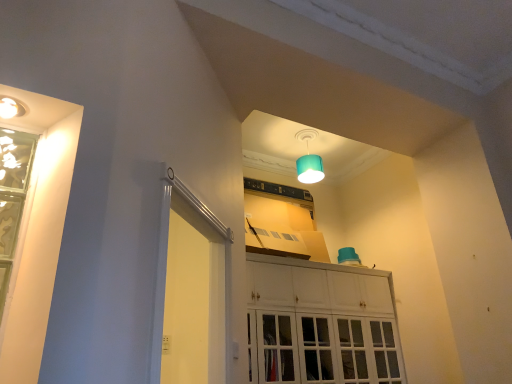
Locate an element on the screen. The image size is (512, 384). white glossy cabinet at center is located at coordinates (320, 323).

What is the approximate height of white glossy cabinet at center?

white glossy cabinet at center is 1.06 meters tall.

Image resolution: width=512 pixels, height=384 pixels. Find the location of `white glossy screen door at left`. white glossy screen door at left is located at coordinates (189, 290).

Is white glossy screen door at left not within green glass window at left?

Yes, white glossy screen door at left is outside of green glass window at left.

In the image, there is a green glass window at left. What are the coordinates of `screen door below it (from the image's perspective)` in the screenshot? It's located at (189, 290).

From the image's perspective, is white glossy screen door at left under green glass window at left?

Yes, from the image's perspective, white glossy screen door at left is beneath green glass window at left.

Is the position of white glossy screen door at left more distant than that of green glass window at left?

Yes, white glossy screen door at left is behind green glass window at left.

Which of these two, white glossy cabinet at center or white glossy screen door at left, is bigger?

Bigger between the two is white glossy cabinet at center.

In the scene shown: From a real-world perspective, which is physically above, white glossy cabinet at center or white glossy screen door at left?

white glossy cabinet at center.

What's the angular difference between white glossy cabinet at center and white glossy screen door at left's facing directions?

The angular difference between white glossy cabinet at center and white glossy screen door at left is 44.8 degrees.

From the picture: Would you say white glossy cabinet at center is inside or outside white glossy screen door at left?

white glossy cabinet at center is located beyond the bounds of white glossy screen door at left.

Is the surface of white glossy screen door at left in direct contact with teal fabric lampshade at upper center?

white glossy screen door at left and teal fabric lampshade at upper center are clearly separated.

Which point is more forward, (221,324) or (304,166)?

The point (221,324) is closer.

Considering the sizes of objects teal fabric lampshade at upper center and green glass window at left in the image provided, who is thinner, teal fabric lampshade at upper center or green glass window at left?

green glass window at left is thinner.

In the image, is teal fabric lampshade at upper center positioned in front of or behind green glass window at left?

teal fabric lampshade at upper center is positioned farther from the viewer than green glass window at left.

Could you tell me if teal fabric lampshade at upper center is turned towards green glass window at left?

No, teal fabric lampshade at upper center is not facing towards green glass window at left.

From a real-world perspective, is teal fabric lampshade at upper center located higher than green glass window at left?

Indeed, from a real-world perspective, teal fabric lampshade at upper center stands above green glass window at left.

Could you tell me if teal fabric lampshade at upper center is turned towards white glossy screen door at left?

No, teal fabric lampshade at upper center is not oriented towards white glossy screen door at left.

Considering the sizes of teal fabric lampshade at upper center and white glossy screen door at left in the image, is teal fabric lampshade at upper center bigger or smaller than white glossy screen door at left?

In the image, teal fabric lampshade at upper center appears to be smaller than white glossy screen door at left.

Is teal fabric lampshade at upper center far away from white glossy screen door at left?

teal fabric lampshade at upper center is far away from white glossy screen door at left.

In order to click on screen door below the teal fabric lampshade at upper center (from a real-world perspective) in this screenshot , I will do `click(189, 290)`.

Is white glossy screen door at left thinner than white glossy cabinet at center?

Yes.

The image size is (512, 384). I want to click on cabinetry that appears above the white glossy screen door at left (from a real-world perspective), so 320,323.

From the image's perspective, is white glossy screen door at left positioned above or below white glossy cabinet at center?

Based on their image positions, white glossy screen door at left is located above white glossy cabinet at center.

Is white glossy screen door at left not close to white glossy cabinet at center?

Yes, white glossy screen door at left and white glossy cabinet at center are quite far apart.

Between point (1, 164) and point (162, 270), which one is positioned in front?

The point (1, 164) is in front.

Between green glass window at left and white glossy screen door at left, which one is positioned behind?

white glossy screen door at left is more distant.

Is green glass window at left taller or shorter than white glossy screen door at left?

green glass window at left is shorter than white glossy screen door at left.

Are green glass window at left and white glossy screen door at left making contact?

No.

This screenshot has height=384, width=512. Identify the location of window above the white glossy screen door at left (from the image's perspective). (12, 197).

Where is `cabinetry located behind the white glossy screen door at left`? cabinetry located behind the white glossy screen door at left is located at coordinates (320, 323).

Estimate the real-world distances between objects in this image. Which object is closer to white glossy screen door at left, white glossy cabinet at center or green glass window at left?

The object closer to white glossy screen door at left is white glossy cabinet at center.

Estimate the real-world distances between objects in this image. Which object is further from teal fabric lampshade at upper center, green glass window at left or white glossy cabinet at center?

green glass window at left lies further to teal fabric lampshade at upper center than the other object.

When comparing their distances from white glossy cabinet at center, does green glass window at left or white glossy screen door at left seem closer?

white glossy screen door at left lies closer to white glossy cabinet at center than the other object.

From the image, which object appears to be farther from white glossy screen door at left, teal fabric lampshade at upper center or green glass window at left?

green glass window at left lies further to white glossy screen door at left than the other object.

Considering their positions, is green glass window at left positioned further to white glossy screen door at left than white glossy cabinet at center?

green glass window at left.

Based on their spatial positions, is white glossy cabinet at center or teal fabric lampshade at upper center further from white glossy screen door at left?

The object further to white glossy screen door at left is teal fabric lampshade at upper center.

Based on their spatial positions, is teal fabric lampshade at upper center or white glossy cabinet at center further from white glossy screen door at left?

teal fabric lampshade at upper center.

Which object lies further to the anchor point green glass window at left, white glossy screen door at left or teal fabric lampshade at upper center?

The object further to green glass window at left is teal fabric lampshade at upper center.

Identify the location of cabinetry located between white glossy screen door at left and teal fabric lampshade at upper center in the depth direction. This screenshot has width=512, height=384. (320, 323).

The height and width of the screenshot is (384, 512). I want to click on cabinetry positioned between green glass window at left and teal fabric lampshade at upper center from near to far, so click(320, 323).

Locate an element on the screen. Image resolution: width=512 pixels, height=384 pixels. screen door between green glass window at left and teal fabric lampshade at upper center in the front-back direction is located at coordinates (189, 290).

The image size is (512, 384). Find the location of `screen door between green glass window at left and white glossy cabinet at center in the front-back direction`. screen door between green glass window at left and white glossy cabinet at center in the front-back direction is located at coordinates pyautogui.click(x=189, y=290).